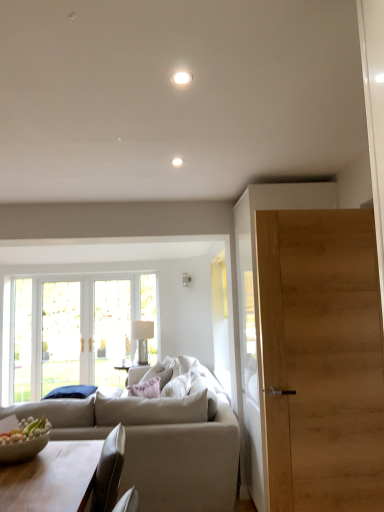
Question: Is there a large distance between silver metallic lamp at center and light wood door at right?

Choices:
 (A) yes
 (B) no

Answer: (A)

Question: From a real-world perspective, is silver metallic lamp at center positioned over light wood door at right based on gravity?

Choices:
 (A) no
 (B) yes

Answer: (A)

Question: Is silver metallic lamp at center with light wood door at right?

Choices:
 (A) no
 (B) yes

Answer: (A)

Question: From a real-world perspective, is silver metallic lamp at center physically below light wood door at right?

Choices:
 (A) yes
 (B) no

Answer: (A)

Question: Can you confirm if silver metallic lamp at center is thinner than light wood door at right?

Choices:
 (A) no
 (B) yes

Answer: (B)

Question: Is silver metallic lamp at center behind light wood door at right?

Choices:
 (A) yes
 (B) no

Answer: (A)

Question: From a real-world perspective, is light wood door at right beneath silver metallic lamp at center?

Choices:
 (A) yes
 (B) no

Answer: (B)

Question: Does light wood door at right have a greater height compared to silver metallic lamp at center?

Choices:
 (A) no
 (B) yes

Answer: (B)

Question: Is light wood door at right positioned far away from silver metallic lamp at center?

Choices:
 (A) yes
 (B) no

Answer: (A)

Question: Is light wood door at right in front of silver metallic lamp at center?

Choices:
 (A) no
 (B) yes

Answer: (B)

Question: Could silver metallic lamp at center be considered to be inside light wood door at right?

Choices:
 (A) no
 (B) yes

Answer: (A)

Question: Can you confirm if light wood door at right is smaller than silver metallic lamp at center?

Choices:
 (A) no
 (B) yes

Answer: (A)

Question: Would you say beige fabric couch at center is part of white fabric pillow at center's contents?

Choices:
 (A) yes
 (B) no

Answer: (B)